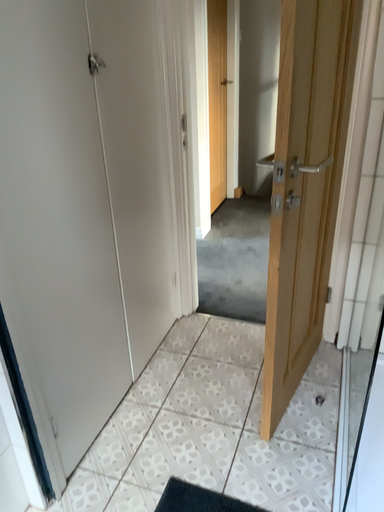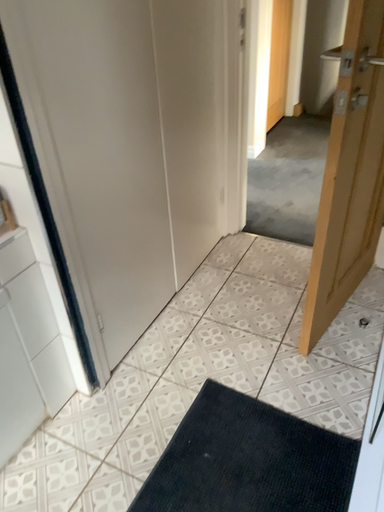
Question: How did the camera likely rotate when shooting the video?

Choices:
 (A) rotated left
 (B) rotated right

Answer: (A)